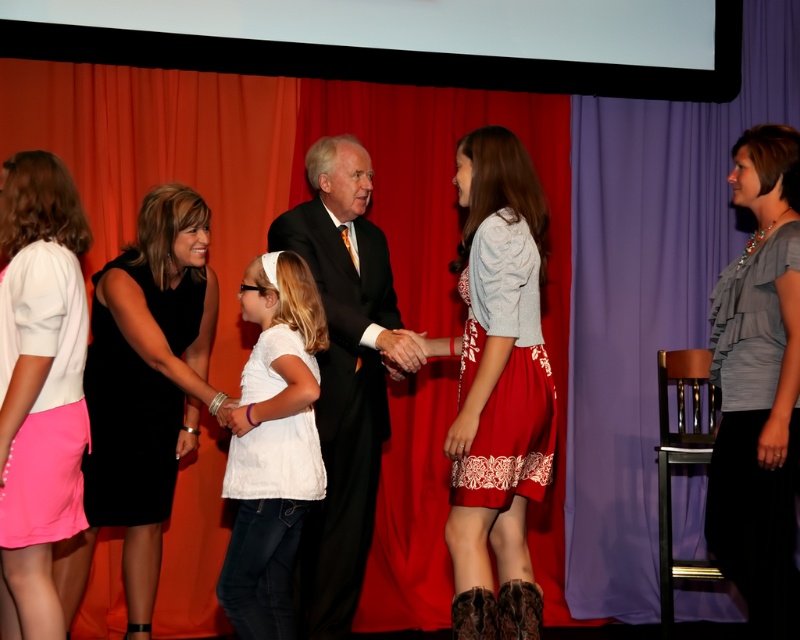
You are an event photographer at the formal event. You need to capture a photo of the white cotton shirt at center and the pink fabric skirt at lower left. Based on their positions, which object should you focus on first to ensure both are in frame?

Since the white cotton shirt at center is to the right of the pink fabric skirt at lower left, you should focus on the pink fabric skirt at lower left first to ensure both are in frame as you pan from left to right.

You are standing on the stage and want to move from point A to point B. Point A is at coordinates point (x=280, y=612) and point B is at coordinates point (x=0, y=362). Which point is closer to you?

Point (x=280, y=612) is further to the viewer than point (x=0, y=362), so point B is closer to you.

You are an event planner standing at the back of the stage and need to ensure there is enough space between the red lace dress at center and the black dress at center for a photographer to move. The photographer requires a minimum of 1 meter between subjects. Is the current distance sufficient?

The red lace dress at center is 1.25 meters from the black dress at center, which is more than the required 1 meter, so the photographer has enough space to move between them.